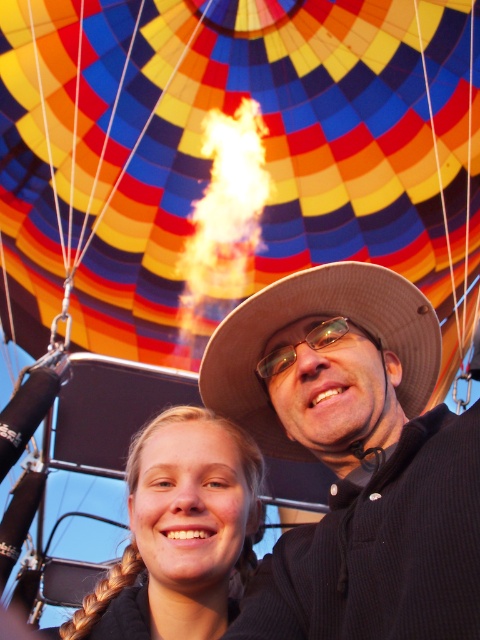
Question: Does blonde hair at center have a lesser width compared to transparent plastic goggles at center?

Choices:
 (A) yes
 (B) no

Answer: (B)

Question: Can you confirm if black textured hat at center is wider than transparent plastic goggles at center?

Choices:
 (A) no
 (B) yes

Answer: (B)

Question: Which of the following is the farthest from the observer?

Choices:
 (A) blonde hair at center
 (B) multicolored fabric balloon at upper center

Answer: (B)

Question: Which point is farther to the camera?

Choices:
 (A) multicolored fabric balloon at upper center
 (B) brown woven hat at center
 (C) black textured hat at center
 (D) blonde hair at center

Answer: (A)

Question: Is the position of black textured hat at center more distant than that of brown woven hat at center?

Choices:
 (A) no
 (B) yes

Answer: (A)

Question: Which of the following is the farthest from the observer?

Choices:
 (A) brown woven hat at center
 (B) transparent plastic goggles at center
 (C) multicolored fabric balloon at upper center

Answer: (C)